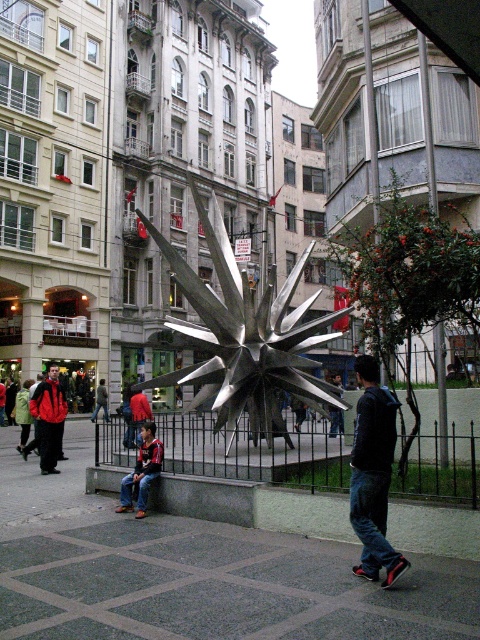
You are standing at the center of the sculpture and want to place a pair of jeans at the lower left corner of the paved area. Is the point at coordinate (142,472) the correct location for this?

Yes, the point at coordinate (142,472) is the correct location as it is where the jeans at lower left are placed.

You are standing in front of the large metallic sculpture at its center. You want to take a photo of the sculpture from a distance of exactly 14.16 meters. Where should you position yourself relative to the point labeled as point (44, 406)?

You should position yourself exactly at the point labeled as point (44, 406) because it is 14.16 meters away from the camera, which is the required distance for taking the photo.